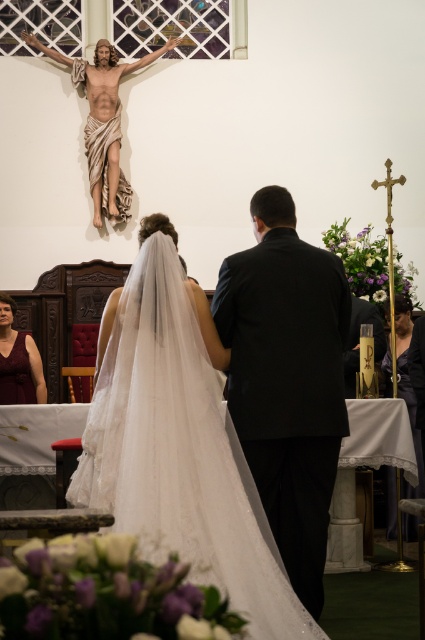
Question: Which of the following is the closest to the observer?

Choices:
 (A) (161, 317)
 (B) (76, 72)
 (C) (306, 545)
 (D) (5, 381)

Answer: (A)

Question: Which of the following is the farthest from the observer?

Choices:
 (A) (81, 64)
 (B) (251, 432)
 (C) (13, 401)
 (D) (207, 355)

Answer: (A)

Question: Which point is farther from the camera taking this photo?

Choices:
 (A) (17, 388)
 (B) (260, 490)

Answer: (A)

Question: Can you confirm if white tulle veil at center is wider than black satin suit at center?

Choices:
 (A) yes
 (B) no

Answer: (A)

Question: Is white tulle veil at center positioned at the back of matte gold statue at upper center?

Choices:
 (A) yes
 (B) no

Answer: (B)

Question: Is matte gold statue at upper center thinner than matte burgundy dress at lower left?

Choices:
 (A) no
 (B) yes

Answer: (A)